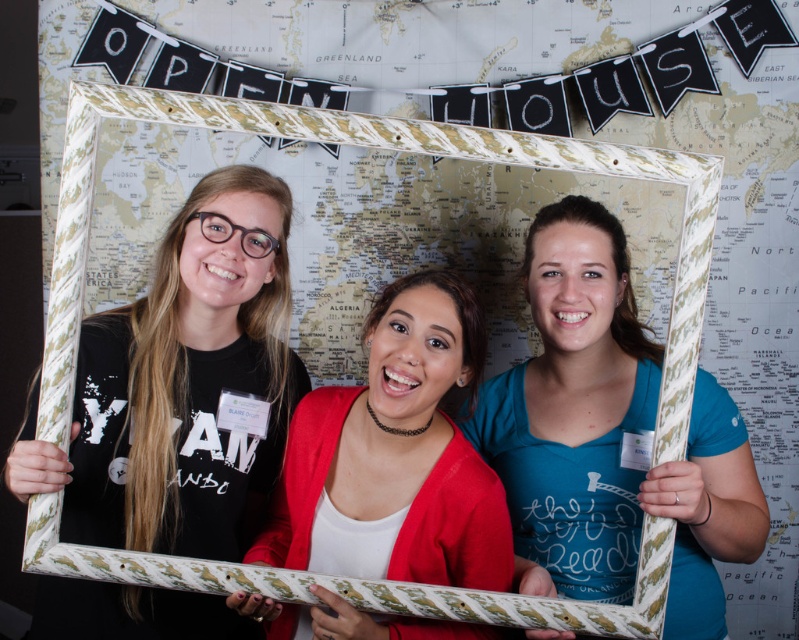
You are standing at the point marked by the coordinates point (692, 408). You want to walk towards the nearest individual. How far will you have to walk?

The nearest individual is 1.31 meters away from point (692, 408), so you will have to walk 1.31 meters to reach them.

You are a photographer trying to capture a group photo. You notice the matte gold frame at center and the matte red cardigan at center in the scene. Which object should you focus on first if you want to ensure the larger object is in sharp focus?

The matte gold frame at center is bigger than the matte red cardigan at center, so you should focus on the matte gold frame at center first to ensure the larger object is in sharp focus.

You are a photographer standing 4 feet away from the matte red cardigan at center. You want to take a closeup shot of the cardigan. Is the current distance sufficient for a clear, detailed photo?

The distance between the matte red cardigan at center and the camera is 3.38 feet. Since you are standing 4 feet away, you are slightly farther than the optimal distance. To capture a clear, detailed photo, you should move closer to reduce the distance to approximately 3.38 feet.